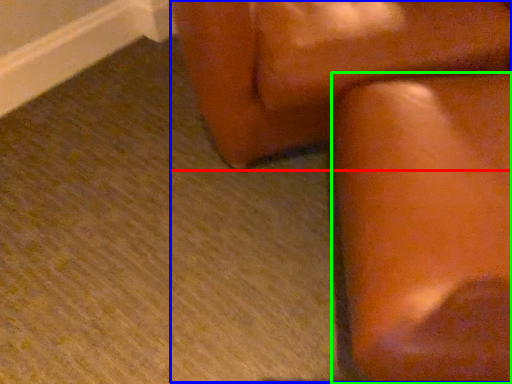
Question: Which object is the closest to the furniture (highlighted by a red box)? Choose among these: rocking chair (highlighted by a blue box) or furniture (highlighted by a green box).

Choices:
 (A) rocking chair
 (B) furniture

Answer: (A)